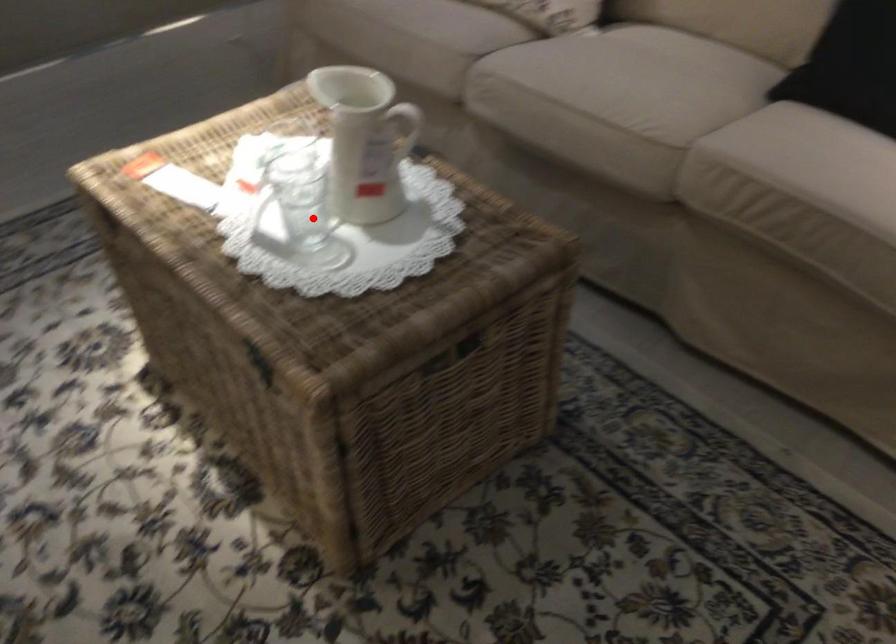
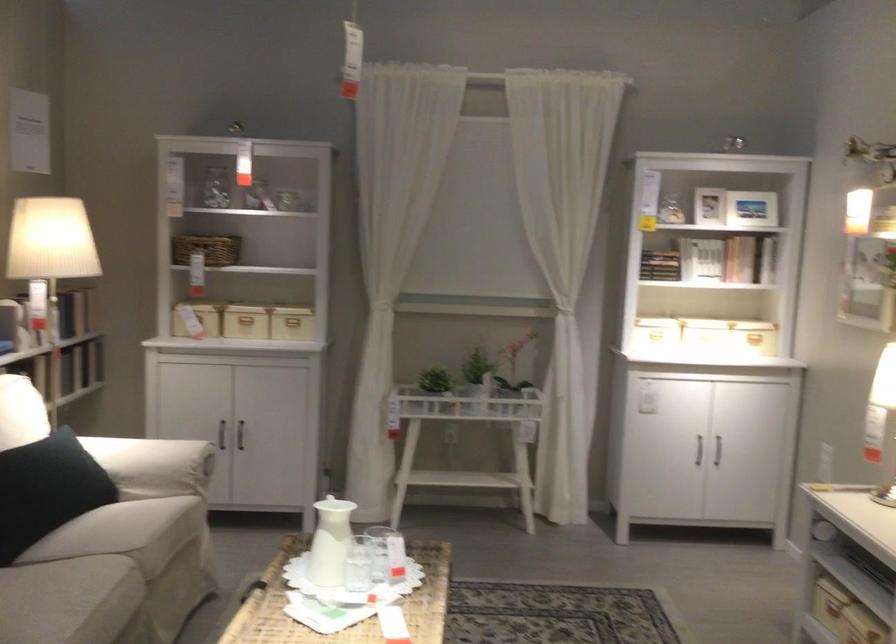
Question: I am providing you with two images of the same scene from different viewpoints. Image1 has a red point marked. In image2, the corresponding 3D location appears at what relative position? Reply with the corresponding letter.

Choices:
 (A) Closer
 (B) Farther

Answer: (B)